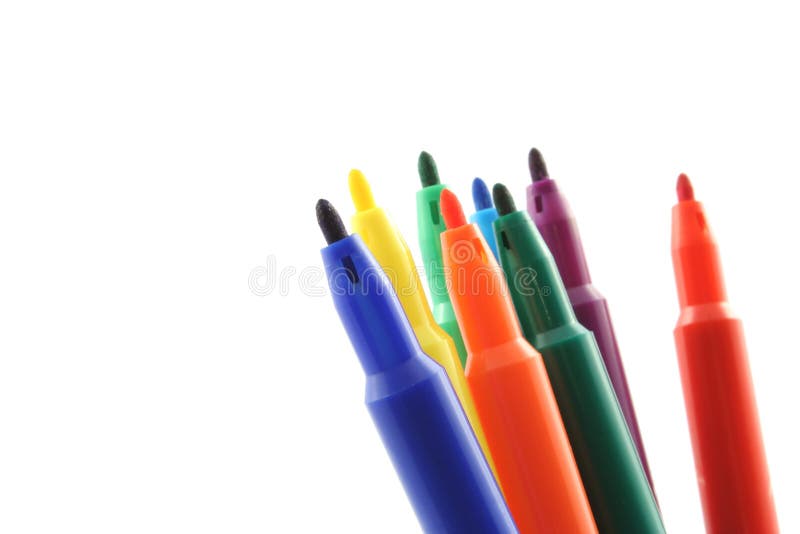
Image resolution: width=800 pixels, height=534 pixels. In order to click on markers in this screenshot , I will do `click(346, 266)`, `click(386, 227)`, `click(424, 222)`, `click(460, 267)`, `click(481, 213)`, `click(510, 235)`, `click(541, 212)`, `click(688, 287)`.